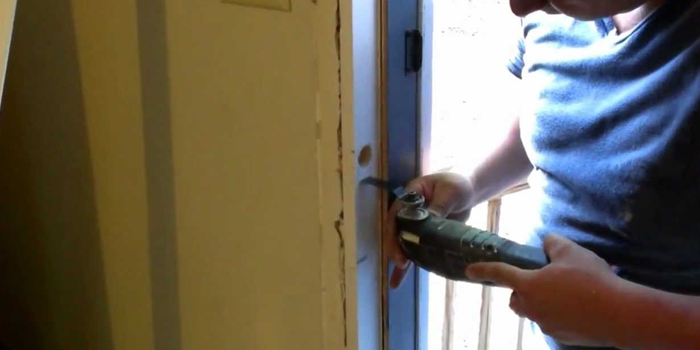
Image resolution: width=700 pixels, height=350 pixels. What are the coordinates of `crack in wall` in the screenshot? It's located at (x=337, y=245), (x=343, y=175), (x=342, y=91).